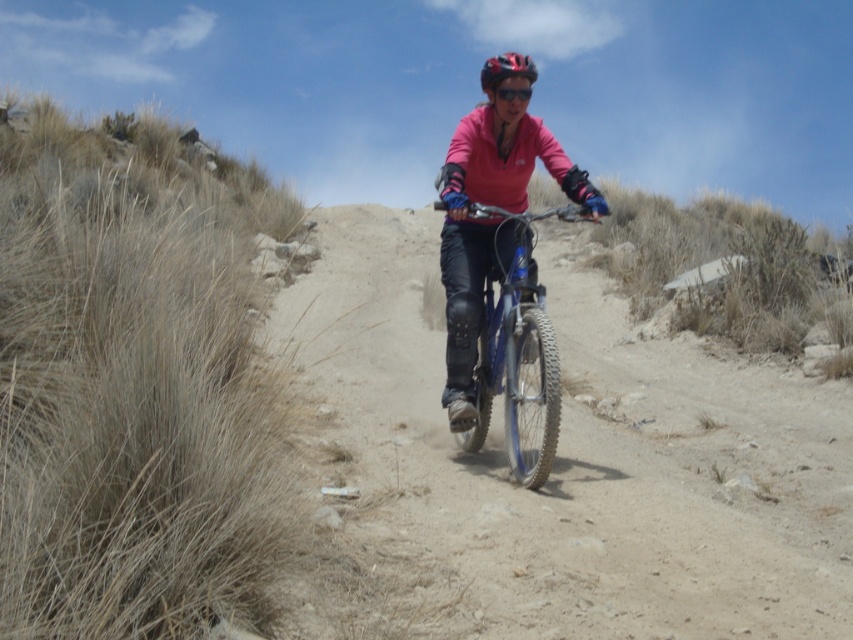
Question: Is blue metallic bicycle at center positioned at the back of shiny red helmet at center?

Choices:
 (A) yes
 (B) no

Answer: (B)

Question: Which object appears farthest from the camera in this image?

Choices:
 (A) shiny red helmet at center
 (B) blue metallic bicycle at center

Answer: (A)

Question: Observing the image, what is the correct spatial positioning of blue metallic bicycle at center in reference to shiny red helmet at center?

Choices:
 (A) below
 (B) above

Answer: (A)

Question: Which of the following is the farthest from the observer?

Choices:
 (A) (494, 81)
 (B) (463, 438)

Answer: (B)

Question: From the image, what is the correct spatial relationship of blue metallic bicycle at center in relation to shiny red helmet at center?

Choices:
 (A) left
 (B) right

Answer: (A)